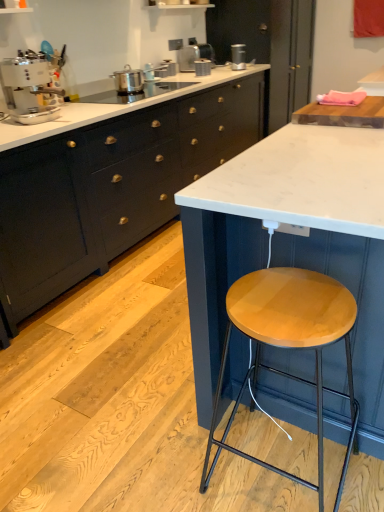
Question: Which direction should I rotate to face matte black cabinet at center, acting as the first cabinetry starting from the right, — up or down?

Choices:
 (A) up
 (B) down

Answer: (A)

Question: Is white marble countertop at center, which is counted as the 1th countertop, starting from the bottom, positioned in front of matte black cabinet at center, the second cabinetry positioned from the left?

Choices:
 (A) yes
 (B) no

Answer: (A)

Question: From a real-world perspective, does white marble countertop at center, which ranks as the 2th countertop in top-to-bottom order, stand above matte black cabinet at center, acting as the first cabinetry starting from the right?

Choices:
 (A) yes
 (B) no

Answer: (B)

Question: Is white marble countertop at center, which ranks as the 2th countertop in top-to-bottom order, located outside matte black cabinet at center, the second cabinetry positioned from the left?

Choices:
 (A) no
 (B) yes

Answer: (B)

Question: Does white marble countertop at center, which ranks as the 2th countertop in top-to-bottom order, turn towards matte black cabinet at center, the second cabinetry positioned from the left?

Choices:
 (A) yes
 (B) no

Answer: (B)

Question: Does white marble countertop at center, which ranks as the 2th countertop in top-to-bottom order, have a smaller size compared to matte black cabinet at center, the second cabinetry positioned from the left?

Choices:
 (A) no
 (B) yes

Answer: (A)

Question: Is matte black cabinet at center, the second cabinetry positioned from the left, located within white marble countertop at center, which ranks as the 2th countertop in top-to-bottom order?

Choices:
 (A) yes
 (B) no

Answer: (B)

Question: Is satin silver toaster at upper center, the second appliance from the top, positioned beyond the bounds of white marble countertop at center, which is counted as the 1th countertop, starting from the bottom?

Choices:
 (A) no
 (B) yes

Answer: (B)

Question: Is satin silver toaster at upper center, the second appliance from the top, in contact with white marble countertop at center, which ranks as the 2th countertop in top-to-bottom order?

Choices:
 (A) yes
 (B) no

Answer: (B)

Question: Is white marble countertop at center, which is counted as the 1th countertop, starting from the bottom, located within satin silver toaster at upper center, acting as the fourth appliance starting from the bottom?

Choices:
 (A) no
 (B) yes

Answer: (A)

Question: Considering the relative sizes of satin silver toaster at upper center, the 5th appliance in the left-to-right sequence, and white marble countertop at center, which ranks as the 2th countertop in top-to-bottom order, in the image provided, is satin silver toaster at upper center, the 5th appliance in the left-to-right sequence, bigger than white marble countertop at center, which ranks as the 2th countertop in top-to-bottom order,?

Choices:
 (A) yes
 (B) no

Answer: (B)

Question: Would you consider satin silver toaster at upper center, the second appliance from the top, to be distant from white marble countertop at center, which is counted as the 1th countertop, starting from the bottom?

Choices:
 (A) no
 (B) yes

Answer: (B)

Question: Does satin silver toaster at upper center, the 1th appliance viewed from the right, have a smaller size compared to white marble countertop at center, which is counted as the 1th countertop, starting from the bottom?

Choices:
 (A) yes
 (B) no

Answer: (A)

Question: Can you confirm if matte black cabinet at center, the second cabinetry positioned from the left, is smaller than wooden cutting board at upper right, the 2th countertop positioned from the bottom?

Choices:
 (A) yes
 (B) no

Answer: (B)